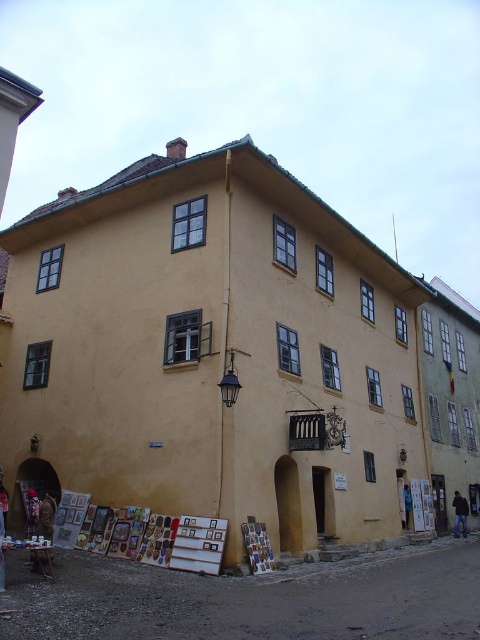
Consider the image. You are a visitor standing in front of the three story building and you see the wooden framed paintings at lower left and the brown leather jacket at lower right. Which object is bigger?

The wooden framed paintings at lower left is larger in size than brown leather jacket at lower right.

Based on the photo, you are standing at the entrance of the building and want to read the wooden signboard at lower left. Based on its position, is it likely visible from your current position?

The wooden signboard at lower left is positioned at point (1, 531), which is very close to the bottom edge of the image. Since you are standing at the entrance, it is likely visible from your current position as it is located near the lower left corner.

You are standing in front of the three story building and want to hang a new painting exactly where the wooden framed paintings at lower left are currently located. What are the coordinates for hanging the new painting?

The coordinates for hanging the new painting are at point (x=32, y=512).